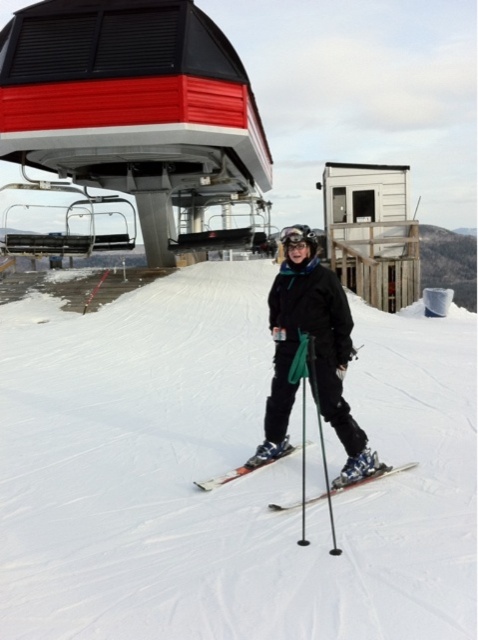
You are a ski equipment inspector checking the equipment of a skier. You notice the green plastic ski pole at center and the shiny metallic skis at center. Which one has a smaller diameter?

The green plastic ski pole at center is thinner than the shiny metallic skis at center, so the green plastic ski pole at center has a smaller diameter.

Consider the image. You are a ski instructor preparing for a lesson. You see the green plastic ski pole at center and the shiny metallic skis at center. Which object is taller?

The green plastic ski pole at center is much taller than the shiny metallic skis at center.

You are a photographer standing at the base of the ski slope. You want to take a closeup shot of the orange metallic skis at center without moving closer than 3 meters. Can you capture the skis clearly in your photo?

The orange metallic skis at center are 3.65 meters away from the camera. Since you can stay at least 3 meters away, you can capture the skis clearly as they are within the required distance range.